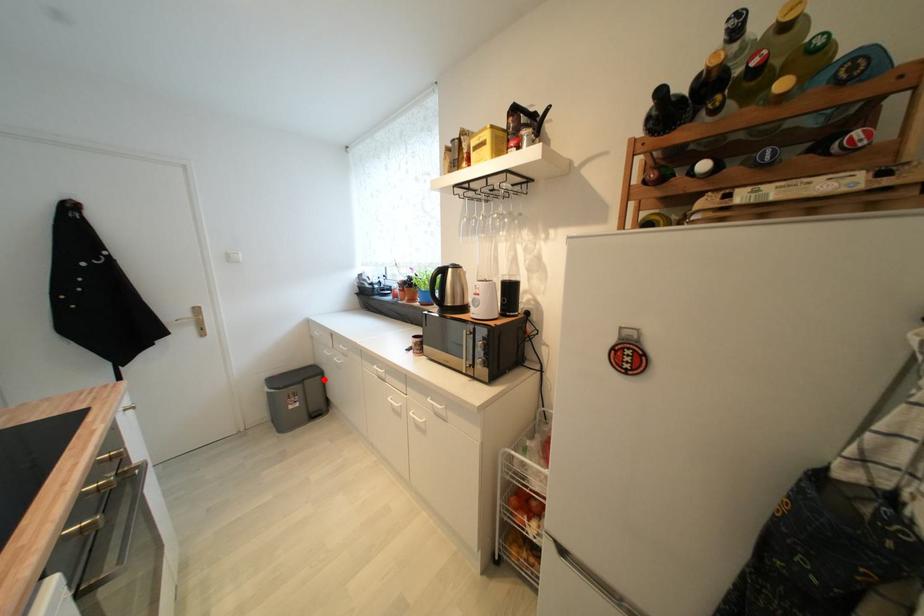
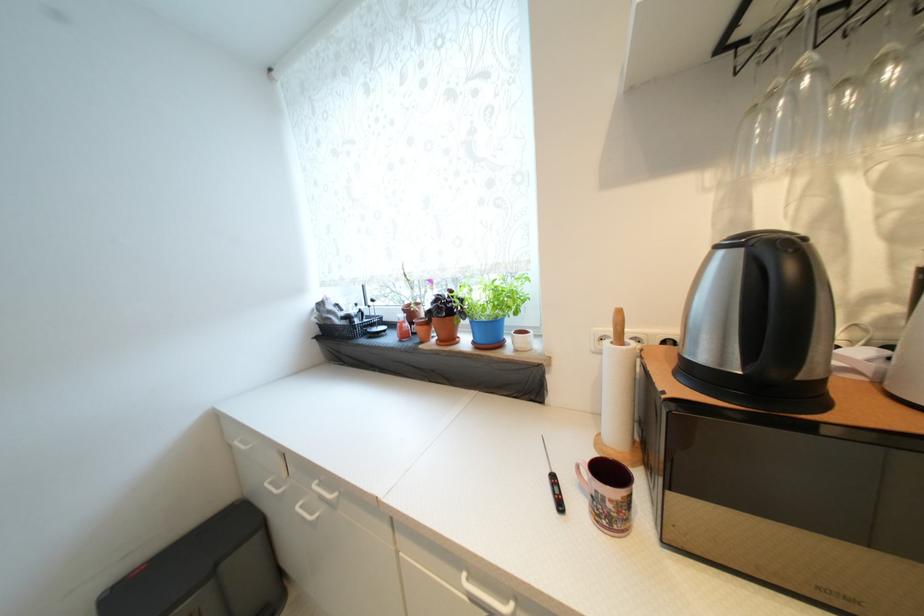
Question: I am providing you with two images of the same scene from different viewpoints. Given a red point in image1, look at the same physical point in image2. Is it:

Choices:
 (A) Closer to the viewpoint
 (B) Farther from the viewpoint

Answer: (A)